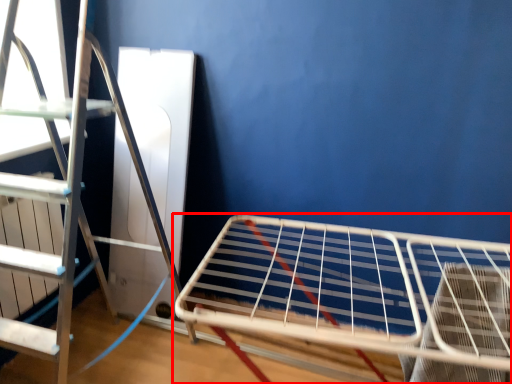
Question: From the image's perspective, what is the correct spatial relationship of furniture (annotated by the red box) in relation to ladder?

Choices:
 (A) below
 (B) above

Answer: (A)